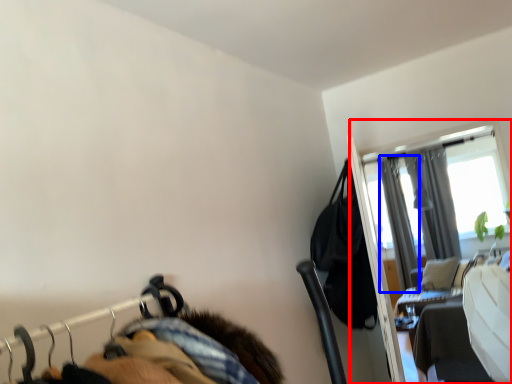
Question: Which of the following is the closest to the observer, screen door (highlighted by a red box) or curtain (highlighted by a blue box)?

Choices:
 (A) screen door
 (B) curtain

Answer: (A)